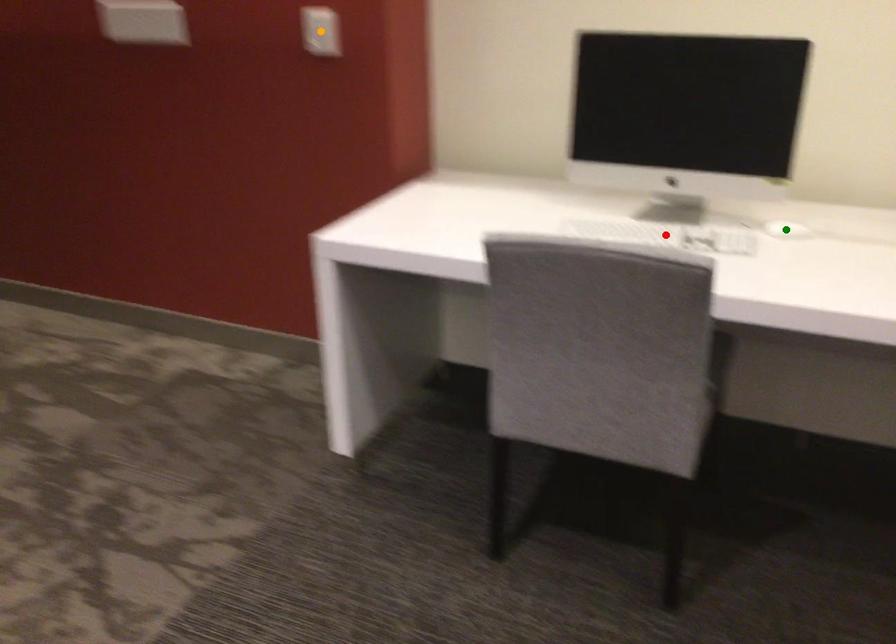
Order these from nearest to farthest:
orange point | green point | red point

green point < red point < orange point